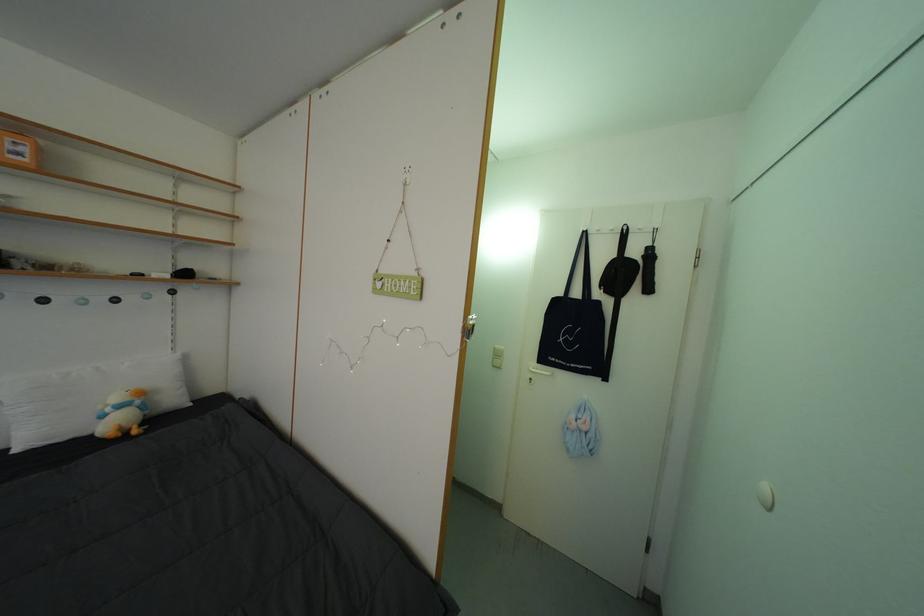
Find where to hang the white wall hook. Please return your answer as a coordinate pair (x, y).

(764, 496)